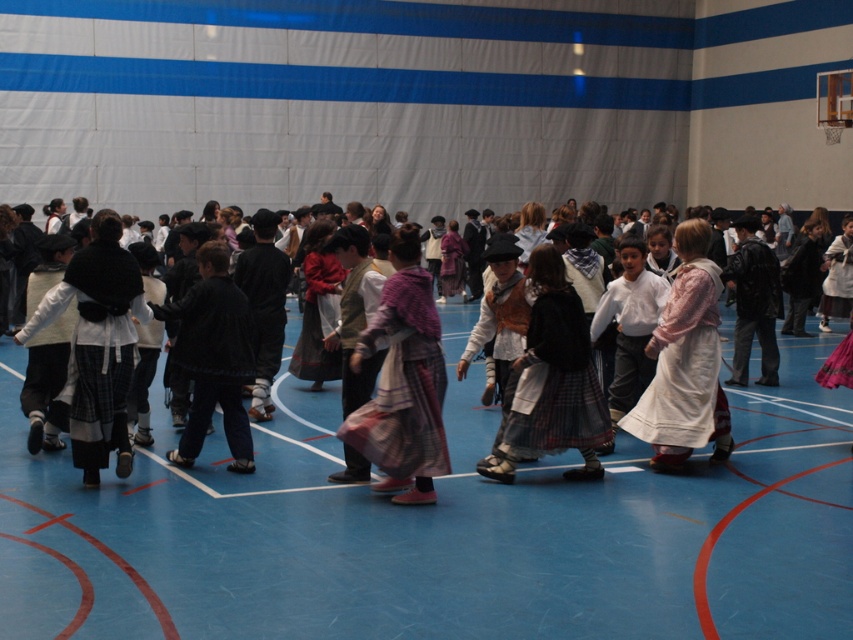
Question: Does blue rubber basketball court at center have a greater width compared to white cotton shirt at center?

Choices:
 (A) yes
 (B) no

Answer: (A)

Question: Which of the following is the farthest from the observer?

Choices:
 (A) blue rubber basketball court at center
 (B) white cotton shirt at center

Answer: (B)

Question: Can you confirm if white cotton dress at center is bigger than white cotton shirt at center?

Choices:
 (A) no
 (B) yes

Answer: (B)

Question: Which point is closer to the camera taking this photo?

Choices:
 (A) (793, 394)
 (B) (624, 353)

Answer: (B)

Question: Among these objects, which one is nearest to the camera?

Choices:
 (A) white cotton shirt at center
 (B) white cotton dress at center

Answer: (B)

Question: Can you confirm if white cotton dress at center is smaller than white cotton shirt at center?

Choices:
 (A) no
 (B) yes

Answer: (A)